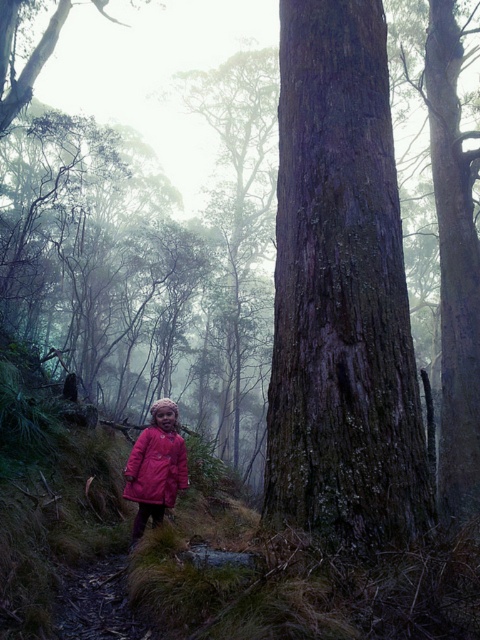
Describe the element at coordinates (340, 296) in the screenshot. This screenshot has height=640, width=480. I see `smooth brown bark at center` at that location.

Is smooth brown bark at center closer to camera compared to matte pink coat at center?

That is True.

Which is behind, point (288, 412) or point (154, 492)?

Point (154, 492)

At what (x,y) coordinates should I click in order to perform the action: click on smooth brown bark at center. Please return your answer as a coordinate pair (x, y). The image size is (480, 640). Looking at the image, I should click on (340, 296).